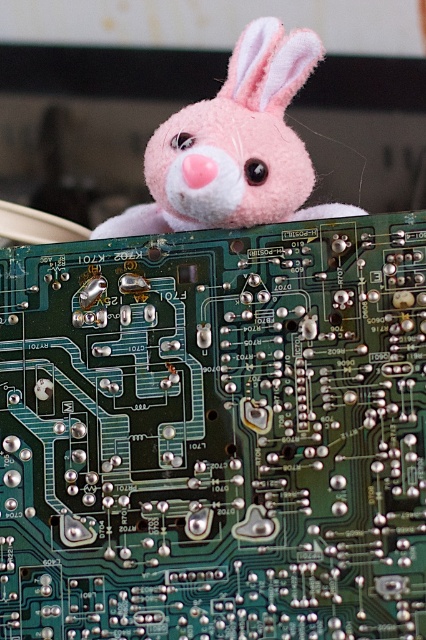
Question: Which point is farther from the camera taking this photo?

Choices:
 (A) (276, 520)
 (B) (252, 72)

Answer: (B)

Question: Does green printed circuit board at center have a smaller size compared to pink plush toy at upper center?

Choices:
 (A) yes
 (B) no

Answer: (A)

Question: Where is green printed circuit board at center located in relation to pink plush toy at upper center in the image?

Choices:
 (A) left
 (B) right

Answer: (A)

Question: Is green printed circuit board at center in front of pink plush toy at upper center?

Choices:
 (A) no
 (B) yes

Answer: (A)